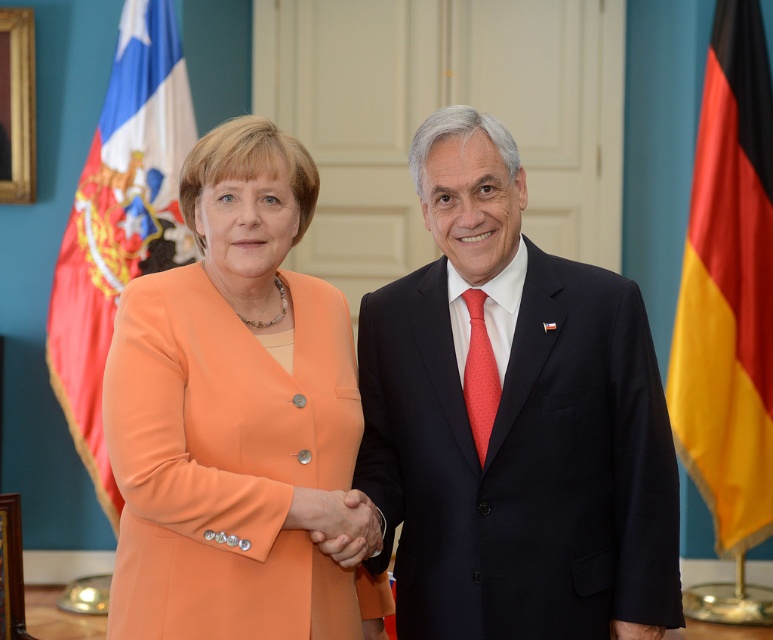
Question: Can you confirm if orange fabric dress at center is wider than red fabric flag at left?

Choices:
 (A) yes
 (B) no

Answer: (B)

Question: Estimate the real-world distances between objects in this image. Which object is farther from the red dotted tie at center?

Choices:
 (A) red fabric flag at left
 (B) matte black suit at center
 (C) yellow fabric flag at right
 (D) orange fabric dress at center

Answer: (A)

Question: Based on their relative distances, which object is nearer to the red dotted tie at center?

Choices:
 (A) yellow fabric flag at right
 (B) orange fabric dress at center

Answer: (B)

Question: Is red fabric flag at left to the left of smooth skin handshake at center from the viewer's perspective?

Choices:
 (A) yes
 (B) no

Answer: (A)

Question: Can you confirm if matte black suit at center is positioned to the right of yellow fabric flag at right?

Choices:
 (A) no
 (B) yes

Answer: (A)

Question: Estimate the real-world distances between objects in this image. Which object is farther from the red fabric flag at left?

Choices:
 (A) orange fabric dress at center
 (B) yellow fabric flag at right

Answer: (B)